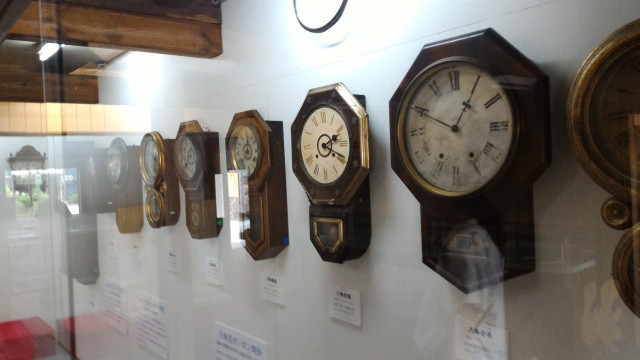
Where is `wall`? The width and height of the screenshot is (640, 360). wall is located at coordinates (392, 26).